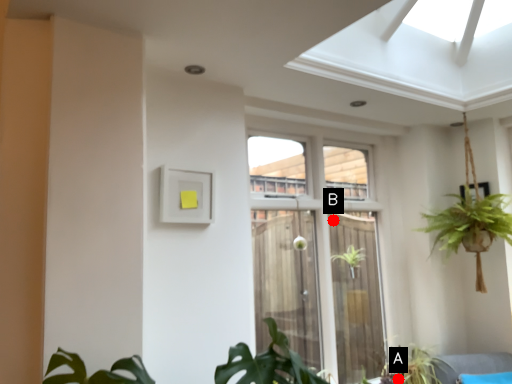
Question: Two points are circled on the image, labeled by A and B beside each circle. Among these points, which one is nearest to the camera?

Choices:
 (A) A is closer
 (B) B is closer

Answer: (A)